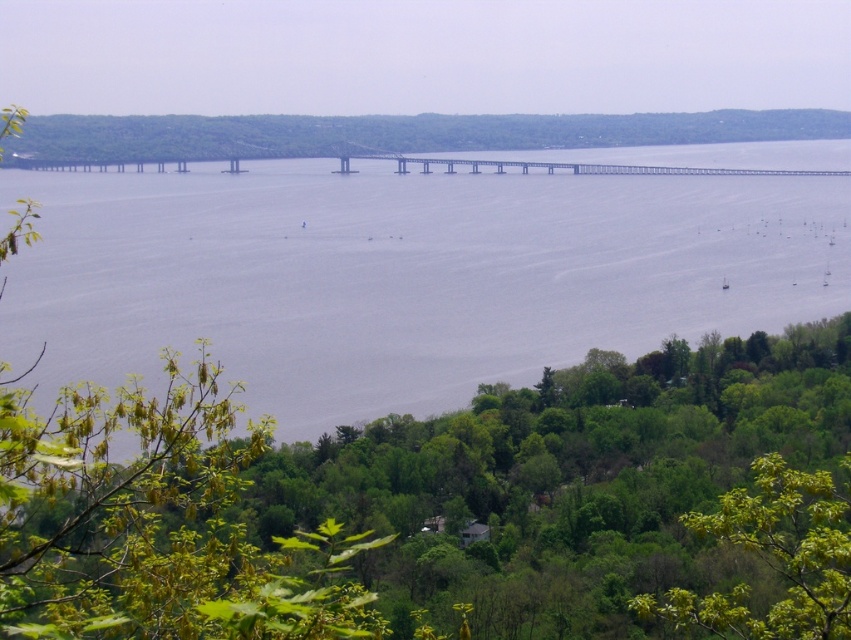
Based on the photo, can you confirm if green leafy tree at lower center is positioned above green leafy tree at lower right?

Correct, green leafy tree at lower center is located above green leafy tree at lower right.

Does green leafy tree at lower center appear on the right side of green leafy tree at lower right?

Incorrect, green leafy tree at lower center is not on the right side of green leafy tree at lower right.

Does point (667, 408) come closer to viewer compared to point (707, 531)?

No, it is not.

I want to click on green leafy tree at lower center, so click(x=575, y=484).

Can you confirm if gray water at center is smaller than green leafy tree at lower right?

No, gray water at center is not smaller than green leafy tree at lower right.

Is gray water at center closer to camera compared to green leafy tree at lower right?

Yes.

You are a GUI agent. You are given a task and a screenshot of the screen. Output one action in this format:
    pyautogui.click(x=<x>, y=<y>)
    Task: Click on the gray water at center
    Image resolution: width=851 pixels, height=640 pixels.
    Given the screenshot: What is the action you would take?
    pyautogui.click(x=403, y=275)

Is gray water at center shorter than green leafy tree at lower center?

Answer: Yes.

Is gray water at center thinner than green leafy tree at lower center?

Incorrect, gray water at center's width is not less than green leafy tree at lower center's.

Between point (787, 163) and point (446, 433), which one is positioned in front?

Positioned in front is point (446, 433).

Find the location of a particular element. The width and height of the screenshot is (851, 640). gray water at center is located at coordinates (403, 275).